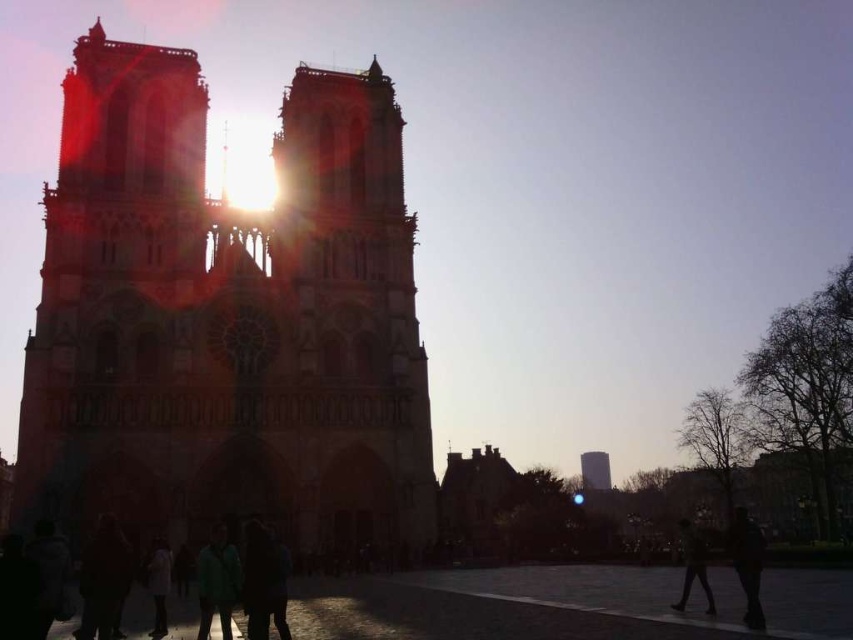
Question: Can you confirm if silhouette stone tower at center is smaller than white matte jacket at lower center?

Choices:
 (A) yes
 (B) no

Answer: (B)

Question: Which point is closer to the camera?

Choices:
 (A) (340, 72)
 (B) (741, 557)

Answer: (B)

Question: Can you confirm if silhouette figure at lower right is thinner than dark fabric jacket at lower right?

Choices:
 (A) no
 (B) yes

Answer: (A)

Question: Which point is closer to the camera taking this photo?

Choices:
 (A) (683, 596)
 (B) (157, 564)
 (C) (358, 360)

Answer: (B)

Question: Which of these objects is positioned farthest from the green matte jacket at lower center?

Choices:
 (A) white matte jacket at lower center
 (B) silhouette stone tower at center
 (C) smooth concrete tower at center

Answer: (C)

Question: Is silhouette stone tower at center closer to the viewer compared to green matte jacket at lower center?

Choices:
 (A) yes
 (B) no

Answer: (A)